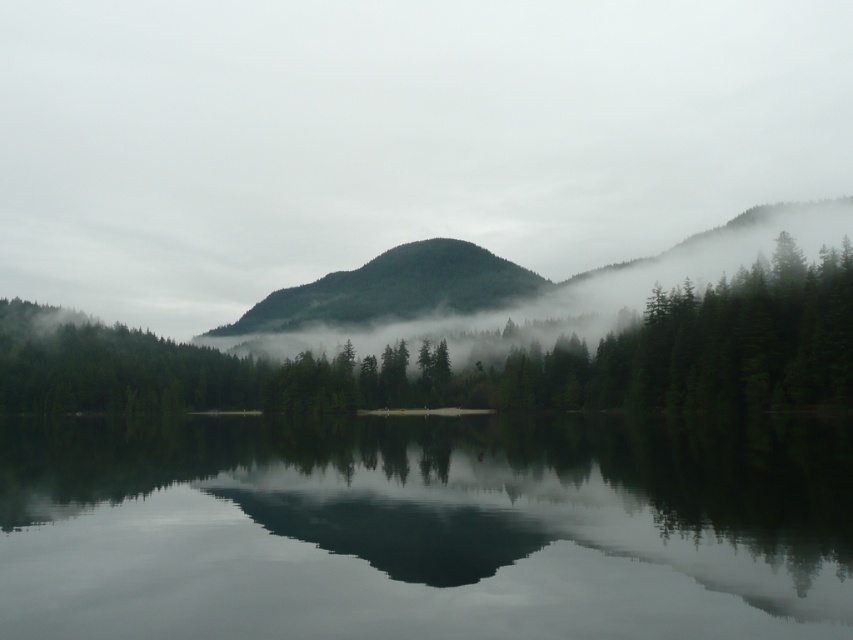
Question: Can you confirm if smooth reflective water at center is positioned to the left of green matte mountain at center?

Choices:
 (A) yes
 (B) no

Answer: (B)

Question: Can you confirm if green matte fog at center is positioned below smooth reflective water at center?

Choices:
 (A) no
 (B) yes

Answer: (A)

Question: Among these points, which one is nearest to the camera?

Choices:
 (A) (38, 552)
 (B) (457, 248)
 (C) (0, 124)
 (D) (241, 404)

Answer: (A)

Question: Is green matte fog at center below smooth reflective water at center?

Choices:
 (A) no
 (B) yes

Answer: (A)

Question: Which of these objects is positioned farthest from the green matte trees at center?

Choices:
 (A) green matte mountain at center
 (B) green matte fog at center

Answer: (B)

Question: Which point is closer to the camera?

Choices:
 (A) green matte trees at center
 (B) green matte fog at center
 (C) smooth reflective water at center

Answer: (C)